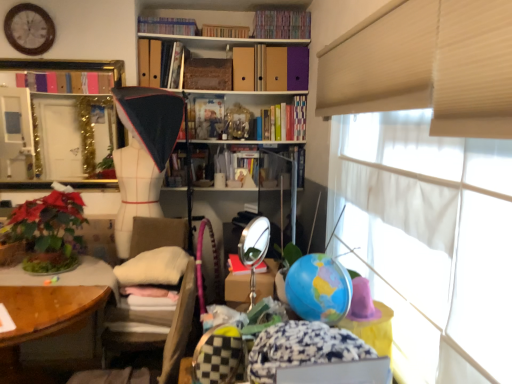
What are the coordinates of `vacant area on top of gold metallic mirror at upper left (from a real-world perspective)` in the screenshot? It's located at (51, 55).